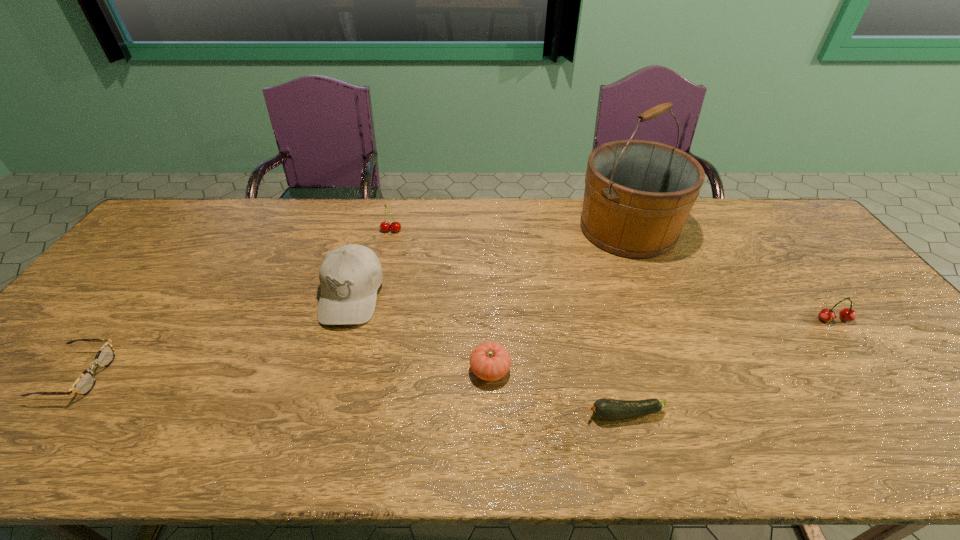
At what (x,y) coordinates should I click in order to perform the action: click on blank area in the image that satisfies the following two spatial constraints: 1. on the front-facing side of the second tallest object; 2. on the frame of the spectacles. Please return your answer as a coordinate pair (x, y). Looking at the image, I should click on (327, 375).

Find the location of a particular element. This screenshot has width=960, height=540. vacant space that satisfies the following two spatial constraints: 1. on the front-facing side of the tomato; 2. on the right side of the second tallest object is located at coordinates (328, 370).

What are the coordinates of `free region that satisfies the following two spatial constraints: 1. on the front-facing side of the tomato; 2. on the right side of the baseball cap` in the screenshot? It's located at (328, 370).

The image size is (960, 540). I want to click on free space that satisfies the following two spatial constraints: 1. with the stems of the left cherry pointing upwards; 2. on the frame of the spectacles, so click(x=356, y=375).

The height and width of the screenshot is (540, 960). Identify the location of free space that satisfies the following two spatial constraints: 1. on the front side of the third shortest object; 2. on the frame of the leftmost object. (491, 375).